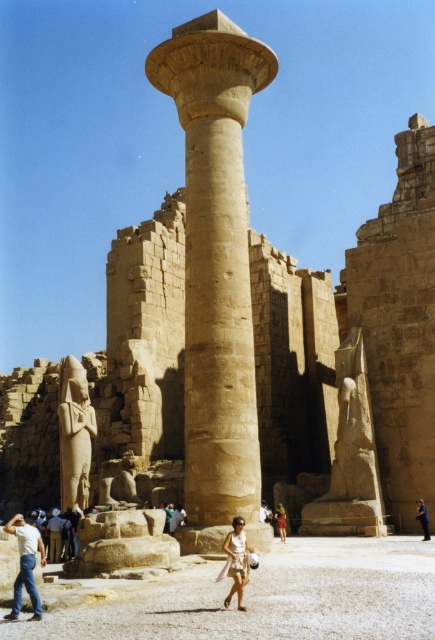
You are a visitor standing at the entrance of the ancient Egyptian temple complex. You see the beige stone column at center and the blue denim jeans at lower center. Which object is positioned higher from the ground?

A: The beige stone column at center is located above the blue denim jeans at lower center, so it is positioned higher from the ground.

You are an archaeologist standing at the center of the temple complex. You need to locate the light brown stone statue at lower left. According to the coordinates provided, where should you look relative to your position?

The light brown stone statue at lower left is located at coordinates point (57,534), which means it is positioned to the lower left relative to your central position in the temple complex.